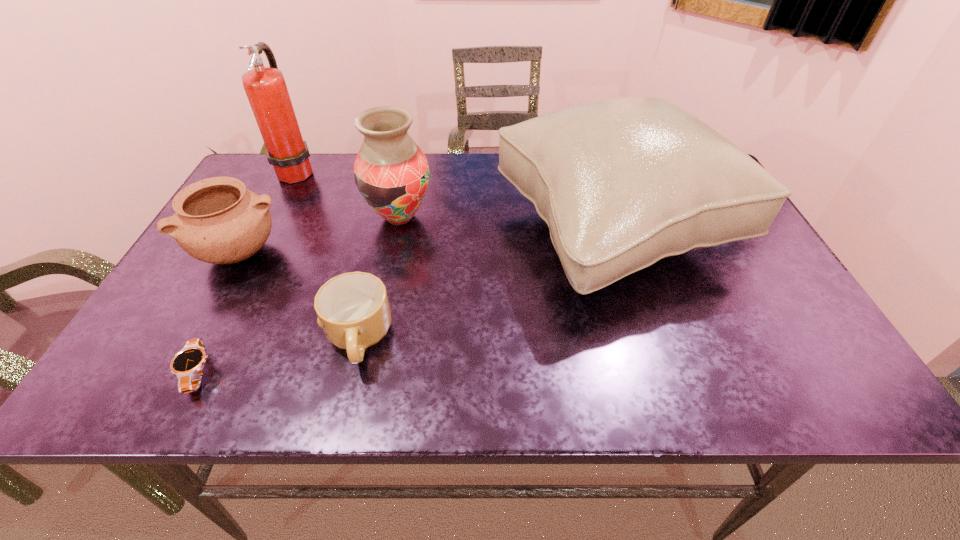
Find the location of a particular element. The image size is (960, 540). free space that is in between the vase and the watch is located at coordinates (299, 294).

At what (x,y) coordinates should I click in order to perform the action: click on empty space that is in between the mug and the watch. Please return your answer as a coordinate pair (x, y). Looking at the image, I should click on (278, 355).

Locate an element on the screen. empty space that is in between the mug and the shortest object is located at coordinates (278, 355).

The height and width of the screenshot is (540, 960). Find the location of `unoccupied position between the vase and the shortest object`. unoccupied position between the vase and the shortest object is located at coordinates (299, 294).

The height and width of the screenshot is (540, 960). Identify the location of unoccupied position between the fourth tallest object and the shortest object. (221, 312).

The image size is (960, 540). Find the location of `vacant region between the mug and the cushion`. vacant region between the mug and the cushion is located at coordinates (486, 284).

Locate an element on the screen. unoccupied position between the vase and the watch is located at coordinates (299, 294).

Select which object is the closest to the pottery. Please provide its 2D coordinates. Your answer should be formatted as a tuple, i.e. [(x, y)], where the tuple contains the x and y coordinates of a point satisfying the conditions above.

[(391, 172)]

Locate an element on the screen. the second closest object to the shortest object is located at coordinates (353, 309).

Find the location of a particular element. This screenshot has width=960, height=540. free space that satisfies the following two spatial constraints: 1. at the nozzle of the rightmost object; 2. on the left side of the fire extinguisher is located at coordinates pos(267,230).